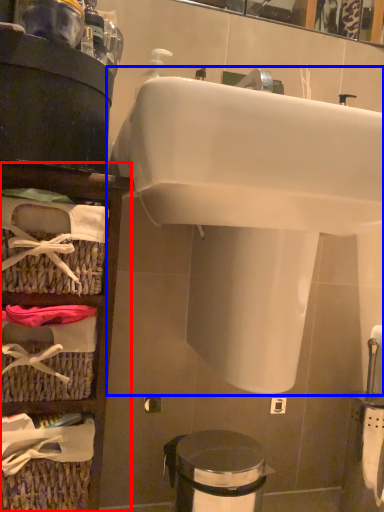
Question: Among these objects, which one is nearest to the camera, shelf (highlighted by a red box) or sink (highlighted by a blue box)?

Choices:
 (A) shelf
 (B) sink

Answer: (B)